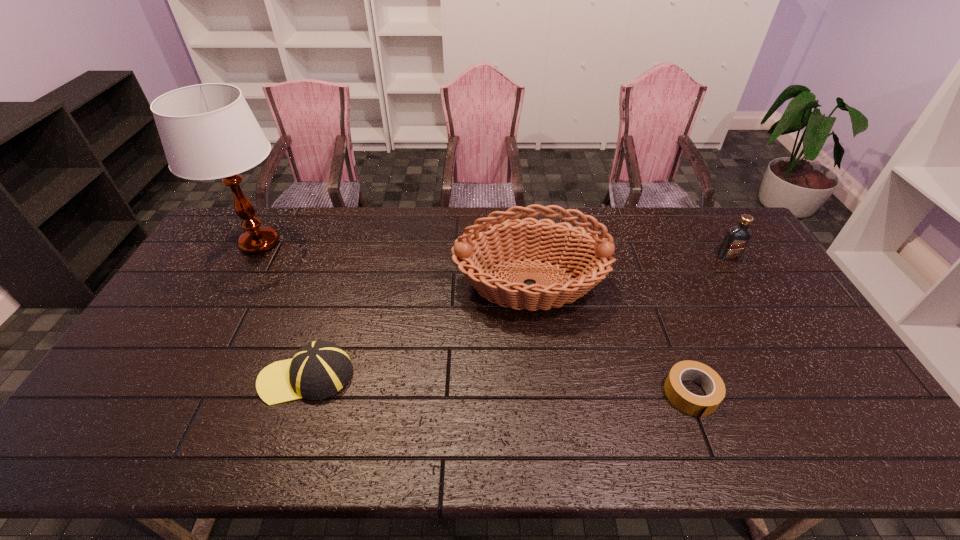
This screenshot has width=960, height=540. Find the location of `empty location between the tallest object and the baseball cap`. empty location between the tallest object and the baseball cap is located at coordinates (283, 310).

Identify which object is the second nearest to the table lamp. Please provide its 2D coordinates. Your answer should be formatted as a tuple, i.e. [(x, y)], where the tuple contains the x and y coordinates of a point satisfying the conditions above.

[(584, 254)]

Identify which object is the third closest to the fourth shortest object. Please provide its 2D coordinates. Your answer should be formatted as a tuple, i.e. [(x, y)], where the tuple contains the x and y coordinates of a point satisfying the conditions above.

[(736, 239)]

Identify the location of free space that satisfies the following two spatial constraints: 1. on the front-facing side of the vodka; 2. with the brim of the second object from left to right facing forward. (802, 376).